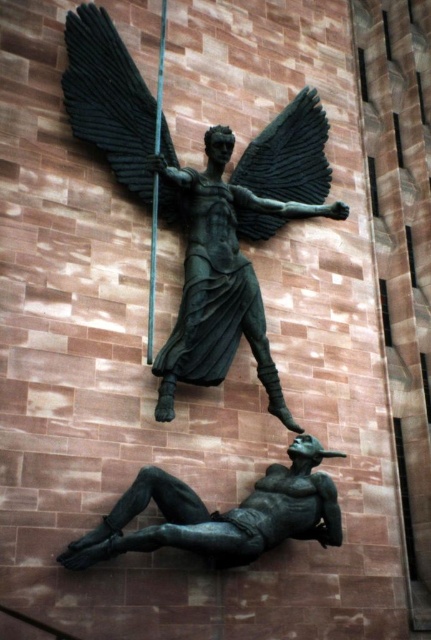
The image size is (431, 640). I want to click on bronze statue at upper center, so click(x=200, y=202).

Looking at this image, does bronze statue at upper center have a smaller size compared to bronze figure at lower center?

No, bronze statue at upper center is not smaller than bronze figure at lower center.

Does point (227, 138) come farther from viewer compared to point (202, 524)?

Yes, it is.

Locate an element on the screen. The width and height of the screenshot is (431, 640). bronze statue at upper center is located at coordinates (200, 202).

Can you confirm if bronze statue at upper center is positioned above black matte wing at upper center?

No, bronze statue at upper center is not above black matte wing at upper center.

This screenshot has width=431, height=640. Identify the location of bronze statue at upper center. (200, 202).

Is point (100, 33) closer to viewer compared to point (149, 163)?

No, it is not.

Find the location of a particular element. The height and width of the screenshot is (640, 431). bronze statue at upper center is located at coordinates (200, 202).

In the scene shown: Is bronze statue at upper center taller than green patina spear at upper center?

In fact, bronze statue at upper center may be shorter than green patina spear at upper center.

Locate an element on the screen. This screenshot has height=640, width=431. bronze statue at upper center is located at coordinates (200, 202).